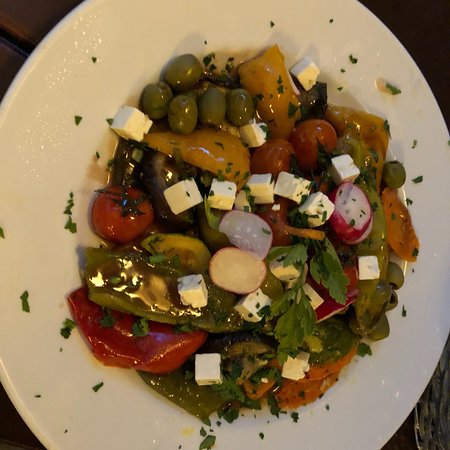
Locate an element on the screen. bowl is located at coordinates (28, 129).